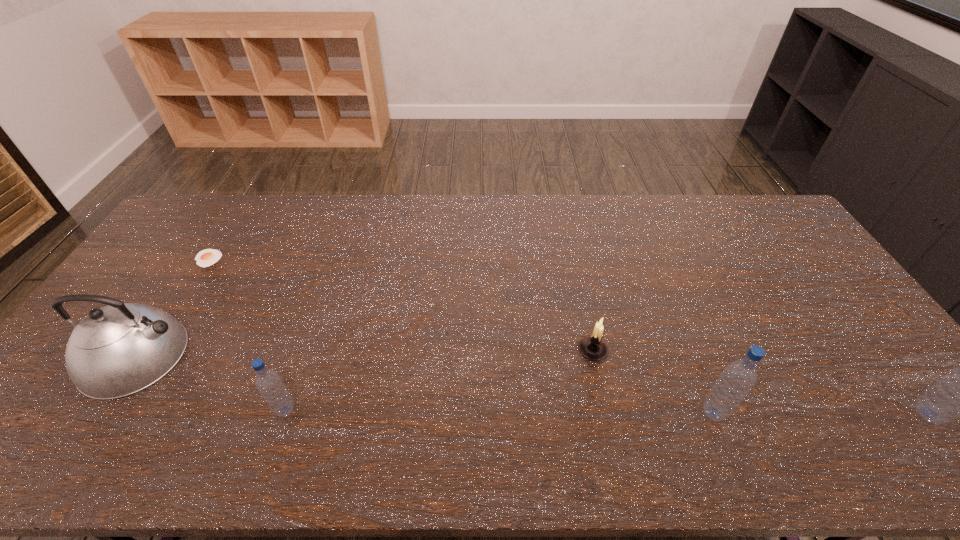
Identify the location of vacant region between the egg yolk and the rightmost object. (568, 336).

This screenshot has height=540, width=960. In order to click on free space between the kettle and the third object from left to right in this screenshot , I will do `click(211, 383)`.

At what (x,y) coordinates should I click in order to perform the action: click on free spot between the second water bottle from right to left and the kettle. Please return your answer as a coordinate pair (x, y). Looking at the image, I should click on (424, 384).

Identify the location of vacant space in between the shortest object and the kettle. (172, 307).

Identify the location of free space between the third object from left to right and the kettle. (211, 383).

This screenshot has width=960, height=540. In order to click on vacant point located between the second shortest object and the shortest water bottle in this screenshot , I will do `click(439, 380)`.

Find the location of a particular element. free spot between the fourth tallest object and the second shortest object is located at coordinates (439, 380).

Where is `vacant area that lies between the fifth tallest object and the tallest object`? vacant area that lies between the fifth tallest object and the tallest object is located at coordinates (760, 382).

Identify which object is the second nearest to the fifth object from left to right. Please provide its 2D coordinates. Your answer should be formatted as a tuple, i.e. [(x, y)], where the tuple contains the x and y coordinates of a point satisfying the conditions above.

[(959, 394)]

Locate an element on the screen. object identified as the third closest to the shortest object is located at coordinates (593, 347).